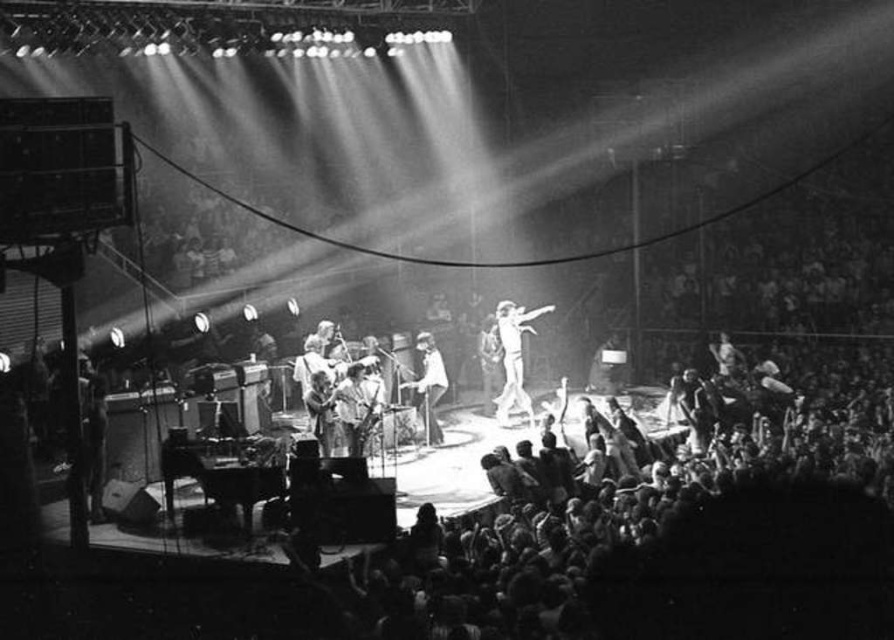
Who is positioned more to the right, white fabric outfit at center or smooth white shirt at center?

From the viewer's perspective, white fabric outfit at center appears more on the right side.

The image size is (894, 640). Describe the element at coordinates (513, 356) in the screenshot. I see `white fabric outfit at center` at that location.

In order to click on white fabric outfit at center in this screenshot , I will do `click(513, 356)`.